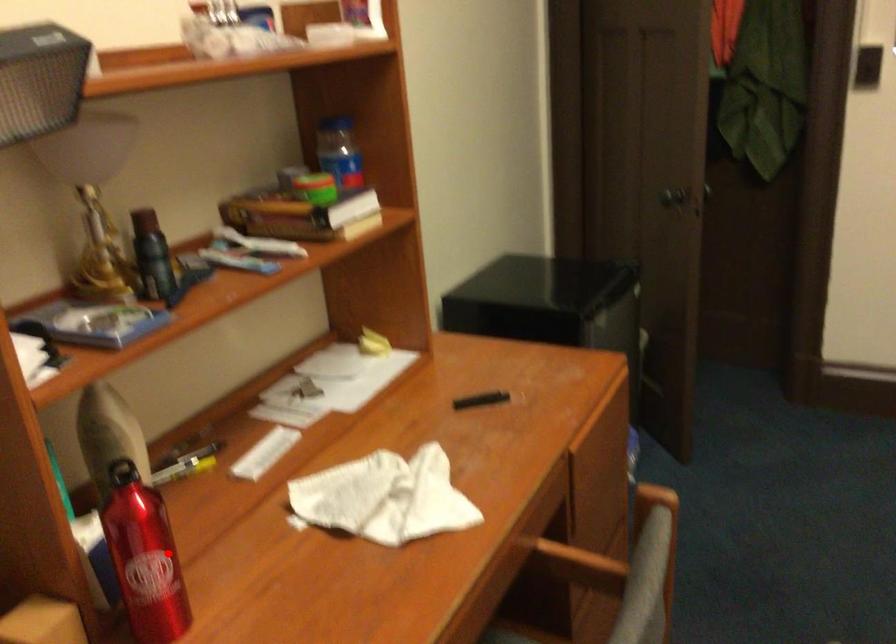
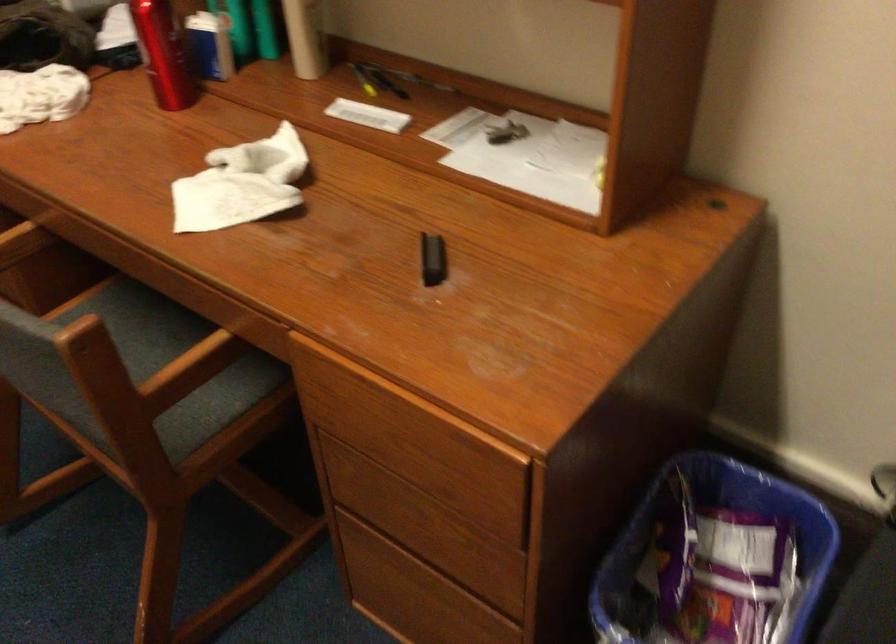
Question: A red point is marked in image1. In image2, is the corresponding 3D point closer to the camera or farther? Reply with the corresponding letter.

Choices:
 (A) The corresponding 3D point is closer.
 (B) The corresponding 3D point is farther.

Answer: (B)